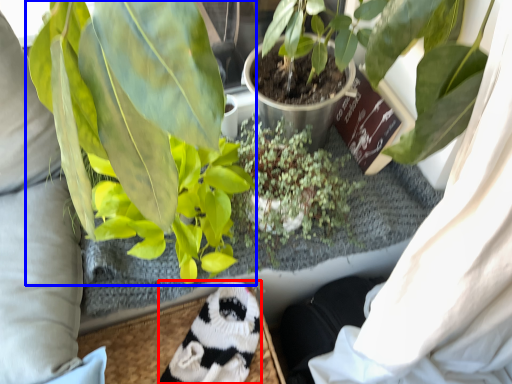
Question: Which object is closer to the camera taking this photo, animal (highlighted by a red box) or houseplant (highlighted by a blue box)?

Choices:
 (A) animal
 (B) houseplant

Answer: (B)